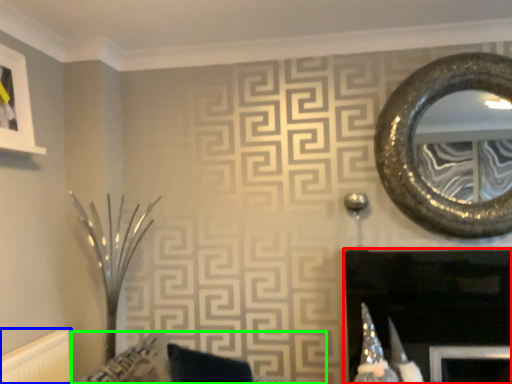
Question: Which is nearer to the fireplace (highlighted by a red box)? radiator (highlighted by a blue box) or furniture (highlighted by a green box).

Choices:
 (A) radiator
 (B) furniture

Answer: (B)